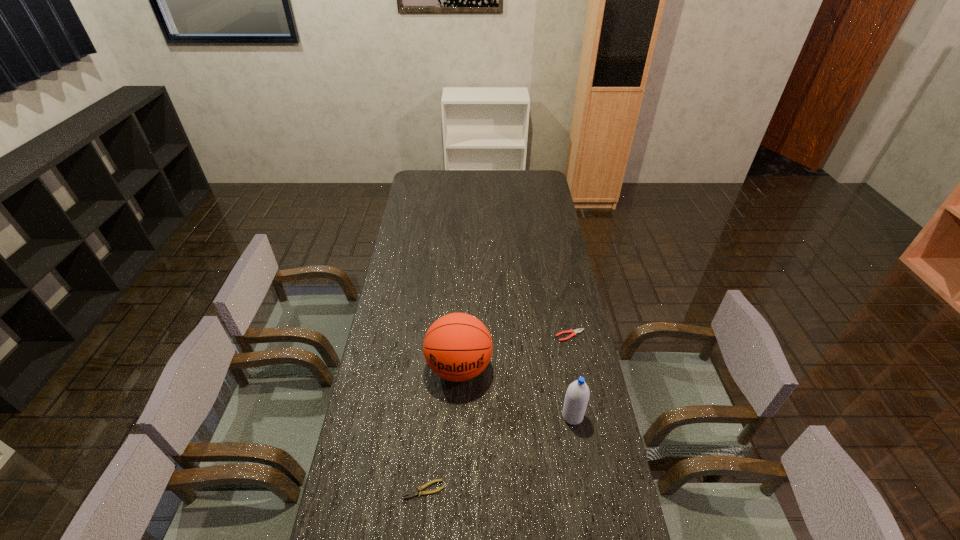
Image resolution: width=960 pixels, height=540 pixels. What are the coordinates of `free location that satisfies the following two spatial constraints: 1. on the side with logo of the third nearest object; 2. on the left side of the water bottle` in the screenshot? It's located at (457, 416).